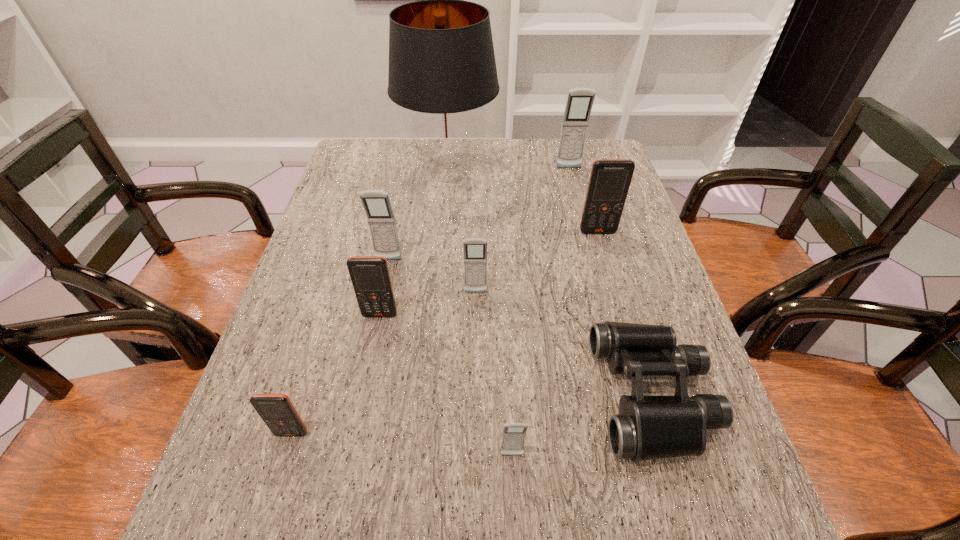
You are a GUI agent. You are given a task and a screenshot of the screen. Output one action in this format:
    pyautogui.click(x=<x>, y=<y>)
    Task: Click on the second nearest orange cellular telephone
    The height and width of the screenshot is (540, 960).
    Given the screenshot: What is the action you would take?
    pyautogui.click(x=370, y=276)

At what (x,y) coordinates should I click in order to perform the action: click on the fourth nearest object. Please return your answer as a coordinate pair (x, y). The height and width of the screenshot is (540, 960). Looking at the image, I should click on (370, 276).

Where is `the sixth farthest cellular telephone`? The image size is (960, 540). the sixth farthest cellular telephone is located at coordinates (277, 411).

Locate an element on the screen. Image resolution: width=960 pixels, height=540 pixels. the leftmost orange cellular telephone is located at coordinates (277, 411).

Identify the location of the nearest cellular telephone. (513, 437).

Find the location of `the third gray cellular telephone from left to right`. the third gray cellular telephone from left to right is located at coordinates (513, 437).

The image size is (960, 540). In order to click on black binoculars in this screenshot , I will do `click(649, 427)`.

This screenshot has height=540, width=960. Find the location of `the shortest object`. the shortest object is located at coordinates (649, 427).

At what (x,y) coordinates should I click in order to perform the action: click on vacant space located 0.390m on the front of the lampshade. Please return your answer as a coordinate pair (x, y). Looking at the image, I should click on (437, 301).

I want to click on vacant space situated on the front-facing side of the biggest gray cellular telephone, so click(583, 222).